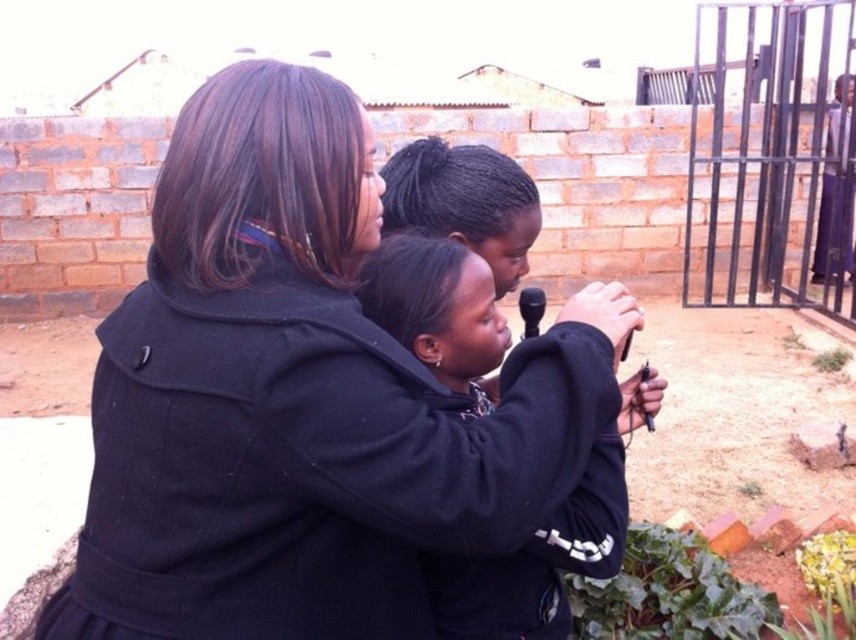
Question: Among these objects, which one is nearest to the camera?

Choices:
 (A) purple fabric pants at right
 (B) metallic gate at right
 (C) black wool coat at center
 (D) dark blue hoodie at center

Answer: (C)

Question: Which of the following is the farthest from the observer?

Choices:
 (A) [758, 237]
 (B) [819, 204]
 (C) [503, 355]

Answer: (B)

Question: Does black wool coat at center have a lesser width compared to purple fabric pants at right?

Choices:
 (A) yes
 (B) no

Answer: (B)

Question: Can you confirm if black wool coat at center is thinner than metallic gate at right?

Choices:
 (A) yes
 (B) no

Answer: (A)

Question: Which point is closer to the camera taking this photo?

Choices:
 (A) (587, 289)
 (B) (821, 243)
 (C) (782, 227)
 (D) (492, 621)

Answer: (A)

Question: Does metallic gate at right appear on the right side of purple fabric pants at right?

Choices:
 (A) yes
 (B) no

Answer: (B)